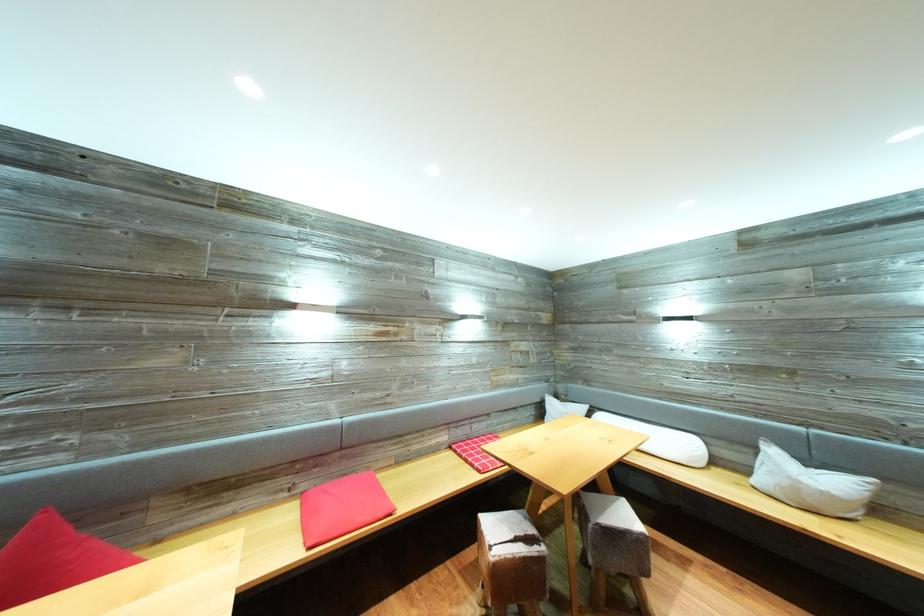
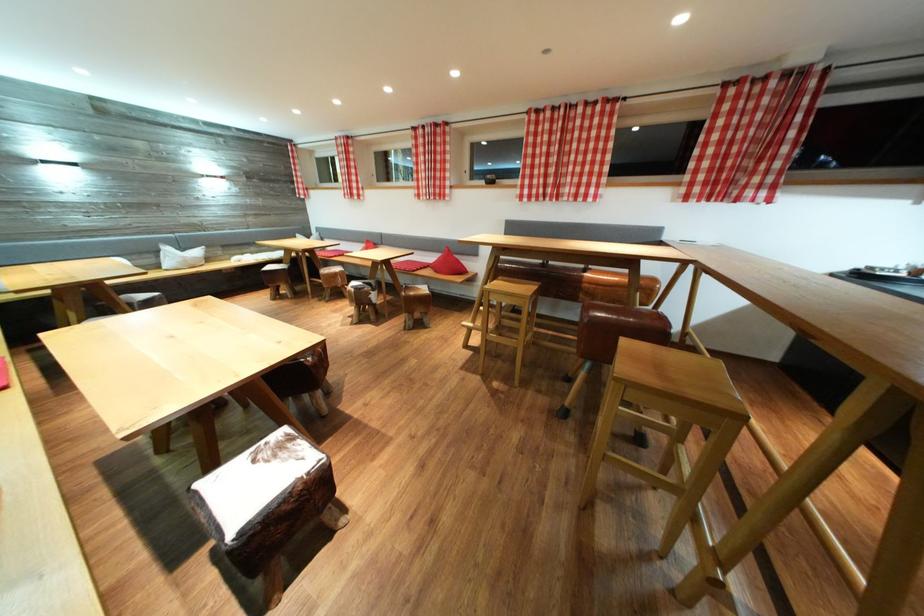
Find the pixel in the second image that matches [781,458] in the first image.

(176, 254)